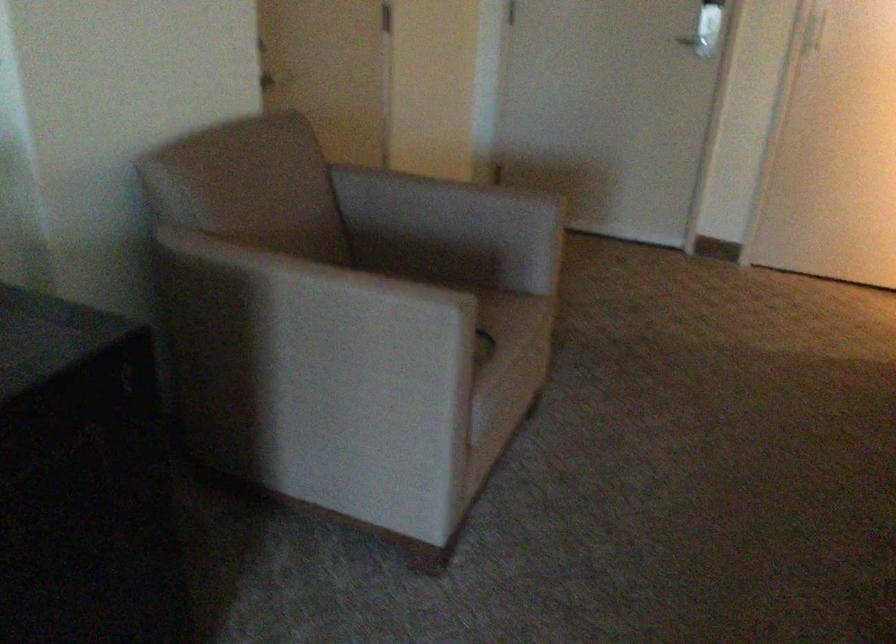
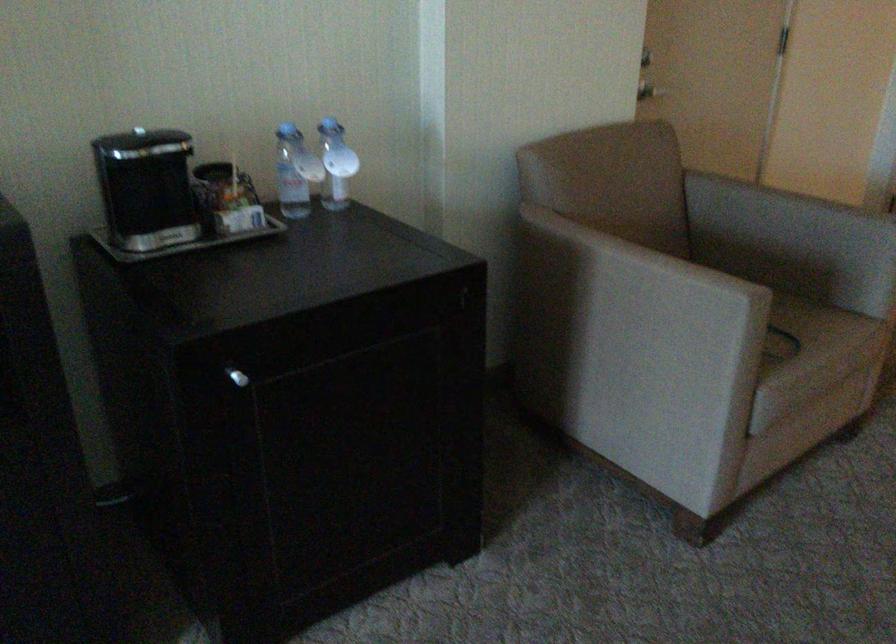
Locate, in the second image, the point that corresponds to (x=265, y=89) in the first image.

(649, 90)